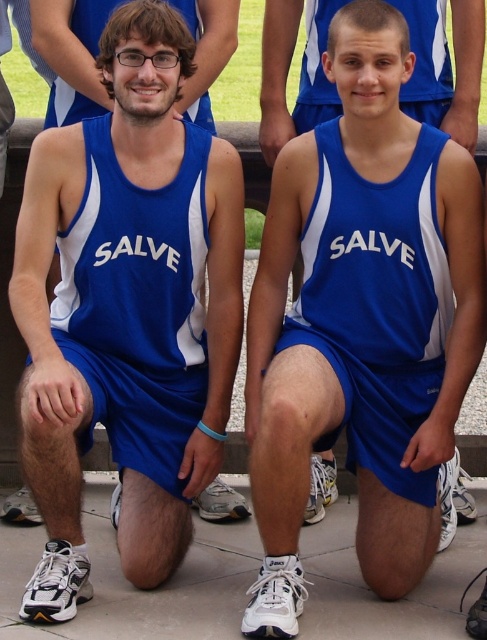
You are a photographer at a sports event and need to position two athletes wearing blue fabric shorts at lower left and blue fabric shorts at center. The distance between them must be exactly 5 meters for the perfect shot. Based on their current positions, is the distance sufficient? Please explain.

The current distance between the blue fabric shorts at lower left and blue fabric shorts at center is 4.28 meters, which is less than the required 5 meters. The photographer needs to adjust their positions to increase the distance by 0.72 meters to achieve the desired separation.

You are a photographer trying to capture a clear shot of both the blue fabric shorts at center and the matte blue singlet at upper center. Based on their positions, which object should you focus on first to ensure both are in focus?

The matte blue singlet at upper center is behind the blue fabric shorts at center, so you should focus on the blue fabric shorts at center first to ensure both are in focus.

You are a photographer trying to capture a closeup of the blue fabric shorts at lower left. Given their position at coordinates point 0.463, 0.287, can you estimate how far they are from the center of the image?

The blue fabric shorts at lower left are located at point [139,296], which is offset from the center of the image. To estimate the distance, you can calculate the Euclidean distance between the point and the center coordinates. However, without knowing the image dimensions, it is difficult to provide an exact distance in pixels. Alternatively, you can note that the x coordinate is 46.3 percent from the left and the y coordinate is 28.7 percent from the top, so it is closer to the bottom left quadrant of